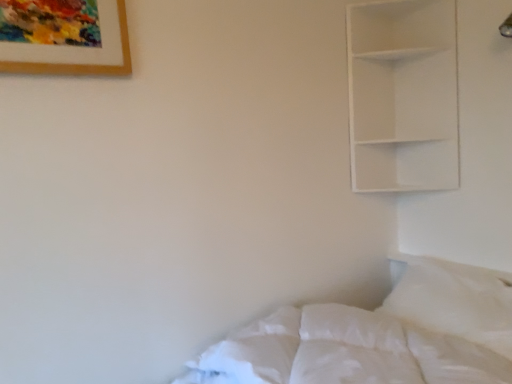
I want to click on white soft bed at lower right, so click(x=379, y=336).

What is the approximate width of white soft pillow at lower right?

The width of white soft pillow at lower right is 14.81 inches.

Describe the element at coordinates (455, 300) in the screenshot. Image resolution: width=512 pixels, height=384 pixels. I see `white soft pillow at lower right` at that location.

Describe the element at coordinates (403, 95) in the screenshot. I see `white matte shelf at upper right` at that location.

Identify the location of white soft bed at lower right. This screenshot has height=384, width=512. (379, 336).

From a real-world perspective, is white matte shelf at upper right above or below wooden framed artwork at upper left?

From a real-world perspective, white matte shelf at upper right is physically below wooden framed artwork at upper left.

Is point (409, 147) positioned in front of point (17, 53)?

No.

From the image's perspective, is white matte shelf at upper right under wooden framed artwork at upper left?

Correct, white matte shelf at upper right appears lower than wooden framed artwork at upper left in the image.

Which is in front, point (117, 49) or point (369, 83)?

The point (117, 49) is closer to the camera.

Considering the relative sizes of wooden framed artwork at upper left and white matte shelf at upper right in the image provided, is wooden framed artwork at upper left taller than white matte shelf at upper right?

No, wooden framed artwork at upper left is not taller than white matte shelf at upper right.

From a real-world perspective, which is physically below, wooden framed artwork at upper left or white matte shelf at upper right?

white matte shelf at upper right is physically lower.

Is wooden framed artwork at upper left situated inside white matte shelf at upper right or outside?

wooden framed artwork at upper left is outside white matte shelf at upper right.

Considering the sizes of wooden framed artwork at upper left and white soft pillow at lower right in the image, is wooden framed artwork at upper left bigger or smaller than white soft pillow at lower right?

Considering their sizes, wooden framed artwork at upper left takes up less space than white soft pillow at lower right.

Is the surface of wooden framed artwork at upper left in direct contact with white soft pillow at lower right?

No, wooden framed artwork at upper left is not beside white soft pillow at lower right.

Considering the sizes of objects wooden framed artwork at upper left and white soft pillow at lower right in the image provided, who is thinner, wooden framed artwork at upper left or white soft pillow at lower right?

wooden framed artwork at upper left.

Is wooden framed artwork at upper left not within white soft pillow at lower right?

Indeed, wooden framed artwork at upper left is completely outside white soft pillow at lower right.

In the image, there is a wooden framed artwork at upper left. Where is `pillow below it (from a real-world perspective)`? The width and height of the screenshot is (512, 384). pillow below it (from a real-world perspective) is located at coordinates (455, 300).

Who is shorter, white soft pillow at lower right or wooden framed artwork at upper left?

Standing shorter between the two is wooden framed artwork at upper left.

Considering their positions, is white soft pillow at lower right located in front of or behind wooden framed artwork at upper left?

white soft pillow at lower right is behind wooden framed artwork at upper left.

Measure the distance between wooden framed artwork at upper left and white soft bed at lower right.

Answer: wooden framed artwork at upper left is 94.63 centimeters from white soft bed at lower right.

Which of these two, wooden framed artwork at upper left or white soft bed at lower right, is wider?

white soft bed at lower right is wider.

Is white soft bed at lower right at the back of wooden framed artwork at upper left?

wooden framed artwork at upper left does not have its back to white soft bed at lower right.

Choose the correct answer: Is wooden framed artwork at upper left inside white soft bed at lower right or outside it?

wooden framed artwork at upper left is not inside white soft bed at lower right, it's outside.

Where is `bed below the wooden framed artwork at upper left (from a real-world perspective)`? The height and width of the screenshot is (384, 512). bed below the wooden framed artwork at upper left (from a real-world perspective) is located at coordinates (379, 336).

Is white soft bed at lower right bigger or smaller than wooden framed artwork at upper left?

Considering their sizes, white soft bed at lower right takes up more space than wooden framed artwork at upper left.

From the picture: Is white soft bed at lower right with wooden framed artwork at upper left?

No, white soft bed at lower right is not making contact with wooden framed artwork at upper left.

Is white soft bed at lower right situated inside white soft pillow at lower right or outside?

white soft bed at lower right is spatially situated outside white soft pillow at lower right.

Visually, is white soft bed at lower right positioned to the left or to the right of white soft pillow at lower right?

white soft bed at lower right is to the left of white soft pillow at lower right.

Which point is more distant from viewer, (392,303) or (444,274)?

The point (392,303) is farther from the camera.

Image resolution: width=512 pixels, height=384 pixels. What are the coordinates of `picture frame located above the white matte shelf at upper right (from a real-world perspective)` in the screenshot? It's located at (64, 37).

This screenshot has width=512, height=384. I want to click on shelf located underneath the wooden framed artwork at upper left (from a real-world perspective), so click(403, 95).

Based on their spatial positions, is white soft bed at lower right or white soft pillow at lower right closer to wooden framed artwork at upper left?

white soft bed at lower right lies closer to wooden framed artwork at upper left than the other object.

Looking at the image, which one is located closer to wooden framed artwork at upper left, white soft pillow at lower right or white matte shelf at upper right?

white matte shelf at upper right is closer to wooden framed artwork at upper left.

When comparing their distances from white soft bed at lower right, does white soft pillow at lower right or white matte shelf at upper right seem further?

Among the two, white matte shelf at upper right is located further to white soft bed at lower right.

Which object lies further to the anchor point white soft pillow at lower right, white soft bed at lower right or white matte shelf at upper right?

The object further to white soft pillow at lower right is white matte shelf at upper right.

Based on their spatial positions, is white soft bed at lower right or wooden framed artwork at upper left closer to white soft pillow at lower right?

white soft bed at lower right is positioned closer to the anchor white soft pillow at lower right.

Which object lies further to the anchor point wooden framed artwork at upper left, white matte shelf at upper right or white soft pillow at lower right?

Among the two, white soft pillow at lower right is located further to wooden framed artwork at upper left.

When comparing their distances from wooden framed artwork at upper left, does white matte shelf at upper right or white soft bed at lower right seem closer?

Based on the image, white soft bed at lower right appears to be nearer to wooden framed artwork at upper left.

When comparing their distances from white soft bed at lower right, does wooden framed artwork at upper left or white soft pillow at lower right seem closer?

Based on the image, white soft pillow at lower right appears to be nearer to white soft bed at lower right.

At what (x,y) coordinates should I click in order to perform the action: click on shelf between wooden framed artwork at upper left and white soft pillow at lower right from left to right. Please return your answer as a coordinate pair (x, y). The height and width of the screenshot is (384, 512). Looking at the image, I should click on (403, 95).

Image resolution: width=512 pixels, height=384 pixels. I want to click on pillow positioned between white soft bed at lower right and white matte shelf at upper right from near to far, so click(x=455, y=300).

The image size is (512, 384). I want to click on bed between wooden framed artwork at upper left and white soft pillow at lower right in the horizontal direction, so click(379, 336).

This screenshot has height=384, width=512. I want to click on bed located between wooden framed artwork at upper left and white matte shelf at upper right in the left-right direction, so click(379, 336).